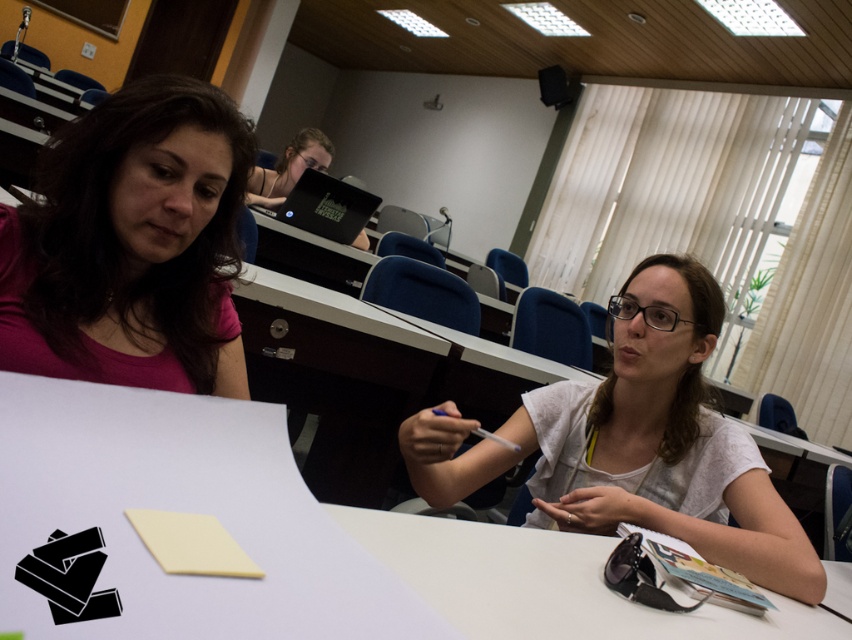
What are the coordinates of the pink matte shirt at upper left?

The pink matte shirt at upper left is located at point (131, 244).

You are a student trying to reach both the black matte laptop at upper center and the matte black laptop at upper center from your current position. Which one is closer to you?

Both the black matte laptop at upper center and the matte black laptop at upper center are the same object, so they are at the same distance from you.

You are organizing a classroom event and need to know the dimensions of the laptops available. Which laptop is wider between the black matte laptop at upper center and the matte black laptop at upper center?

The black matte laptop at upper center is wider than the matte black laptop at upper center according to the description.